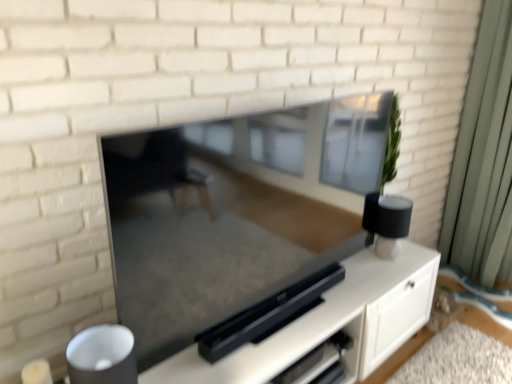
What do you see at coordinates (316, 325) in the screenshot? The image size is (512, 384). I see `satin black entertainment center at center` at bounding box center [316, 325].

Where is `satin black entertainment center at center`? satin black entertainment center at center is located at coordinates (316, 325).

Find the location of a particular element. satin black entertainment center at center is located at coordinates (316, 325).

Is satin black entertainment center at center touching matte black tv at center?

No.

Can you confirm if satin black entertainment center at center is bigger than matte black tv at center?

Indeed, satin black entertainment center at center has a larger size compared to matte black tv at center.

Is satin black entertainment center at center located outside matte black tv at center?

Yes, satin black entertainment center at center is not within matte black tv at center.

Between point (313, 316) and point (126, 266), which one is positioned behind?

Point (313, 316)

Based on the photo, from a real-world perspective, who is located lower, matte black tv at center or green fabric curtain at right?

In real-world perspective, green fabric curtain at right is lower.

Locate an element on the screen. This screenshot has height=384, width=512. curtain below the matte black tv at center (from a real-world perspective) is located at coordinates (484, 159).

Does matte black tv at center lie in front of green fabric curtain at right?

That is True.

From the image's perspective, is matte black tv at center above or below green fabric curtain at right?

Based on their image positions, matte black tv at center is located beneath green fabric curtain at right.

Would you say matte black tv at center is inside or outside satin black entertainment center at center?

matte black tv at center is located beyond the bounds of satin black entertainment center at center.

Could you tell me if matte black tv at center is facing satin black entertainment center at center?

No, matte black tv at center is not oriented towards satin black entertainment center at center.

Is matte black tv at center beside satin black entertainment center at center?

There is a gap between matte black tv at center and satin black entertainment center at center.

How much distance is there between green fabric curtain at right and matte black tv at center?

green fabric curtain at right is 5.24 feet from matte black tv at center.

From their relative heights in the image, would you say green fabric curtain at right is taller or shorter than matte black tv at center?

Considering their sizes, green fabric curtain at right has more height than matte black tv at center.

Is point (483, 91) positioned in front of point (200, 311)?

No.

How many degrees apart are the facing directions of green fabric curtain at right and matte black tv at center?

90.1 degrees separate the facing orientations of green fabric curtain at right and matte black tv at center.

Does point (501, 138) come closer to viewer compared to point (208, 361)?

No, (501, 138) is behind (208, 361).

Is green fabric curtain at right aimed at satin black entertainment center at center?

Yes, green fabric curtain at right is aimed at satin black entertainment center at center.

Considering the sizes of objects green fabric curtain at right and satin black entertainment center at center in the image provided, who is shorter, green fabric curtain at right or satin black entertainment center at center?

With less height is satin black entertainment center at center.

You are a GUI agent. You are given a task and a screenshot of the screen. Output one action in this format:
    pyautogui.click(x=<x>, y=<y>)
    Task: Click on the entertainment center located underneath the green fabric curtain at right (from a real-world perspective)
    Image resolution: width=512 pixels, height=384 pixels.
    Given the screenshot: What is the action you would take?
    pyautogui.click(x=316, y=325)

Which point is more forward, [214,365] or [480,210]?

Point [214,365]

Is satin black entertainment center at center aimed at green fabric curtain at right?

No, satin black entertainment center at center is not facing towards green fabric curtain at right.

How distant is satin black entertainment center at center from green fabric curtain at right?

satin black entertainment center at center and green fabric curtain at right are 3.81 feet apart.

From a real-world perspective, is satin black entertainment center at center on top of green fabric curtain at right?

Incorrect, from a real-world perspective, satin black entertainment center at center is lower than green fabric curtain at right.

Identify the location of fireplace in front of the satin black entertainment center at center. The image size is (512, 384). (178, 250).

Find the location of a particular element. This screenshot has height=384, width=512. fireplace that appears above the green fabric curtain at right (from a real-world perspective) is located at coordinates (178, 250).

Looking at the image, which one is located closer to green fabric curtain at right, satin black entertainment center at center or matte black tv at center?

satin black entertainment center at center lies closer to green fabric curtain at right than the other object.

From the image, which object appears to be farther from matte black tv at center, green fabric curtain at right or satin black entertainment center at center?

green fabric curtain at right is positioned further to the anchor matte black tv at center.

Which object lies nearer to the anchor point green fabric curtain at right, matte black tv at center or satin black entertainment center at center?

Among the two, satin black entertainment center at center is located nearer to green fabric curtain at right.

Based on their spatial positions, is green fabric curtain at right or matte black tv at center closer to satin black entertainment center at center?

matte black tv at center is closer to satin black entertainment center at center.

Based on their spatial positions, is matte black tv at center or green fabric curtain at right closer to satin black entertainment center at center?

Based on the image, matte black tv at center appears to be nearer to satin black entertainment center at center.

Looking at the image, which one is located further to matte black tv at center, satin black entertainment center at center or green fabric curtain at right?

green fabric curtain at right is positioned further to the anchor matte black tv at center.

Identify the location of entertainment center between matte black tv at center and green fabric curtain at right in the horizontal direction. (316, 325).